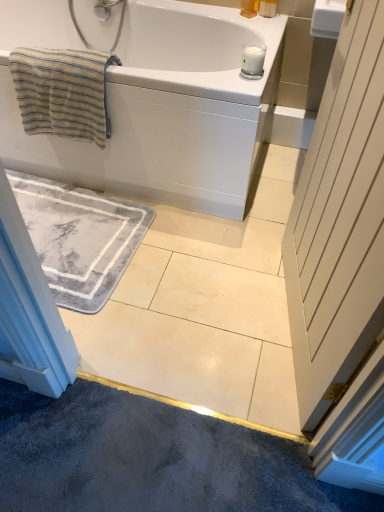
Question: In terms of size, does white wooden door at right appear bigger or smaller than matte yellow soap at upper center, the second toiletry viewed from the right?

Choices:
 (A) small
 (B) big

Answer: (B)

Question: In terms of height, does white wooden door at right look taller or shorter compared to matte yellow soap at upper center, acting as the first toiletry starting from the left?

Choices:
 (A) short
 (B) tall

Answer: (B)

Question: Which object is the closest to the white glossy bathtub at upper center?

Choices:
 (A) white matte glass at upper center
 (B) matte yellow soap at upper center, acting as the first toiletry starting from the left
 (C) white wooden door at right
 (D) gray plush bath mat at lower left
 (E) beige striped towel at upper left

Answer: (E)

Question: Which object is positioned farthest from the matte yellow soap at upper center, acting as the first toiletry starting from the left?

Choices:
 (A) gray plush bath mat at lower left
 (B) white glossy bathtub at upper center
 (C) beige striped towel at upper left
 (D) matte plastic soap at upper right, placed as the 1th toiletry when sorted from right to left
 (E) white wooden door at right

Answer: (E)